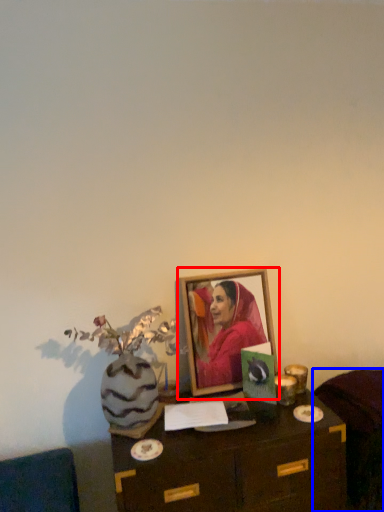
Question: Which of the following is the closest to the observer, picture frame (highlighted by a red box) or furniture (highlighted by a blue box)?

Choices:
 (A) picture frame
 (B) furniture

Answer: (B)